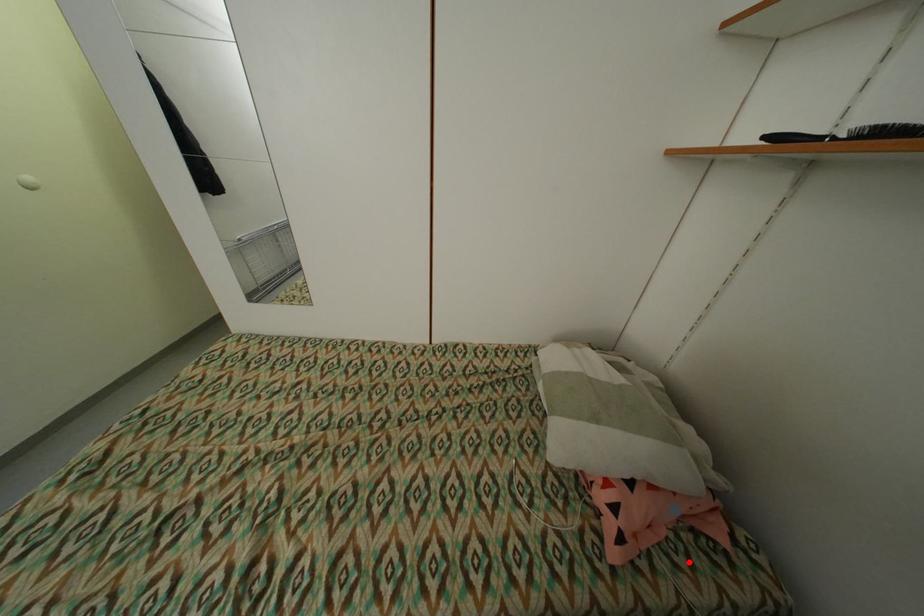
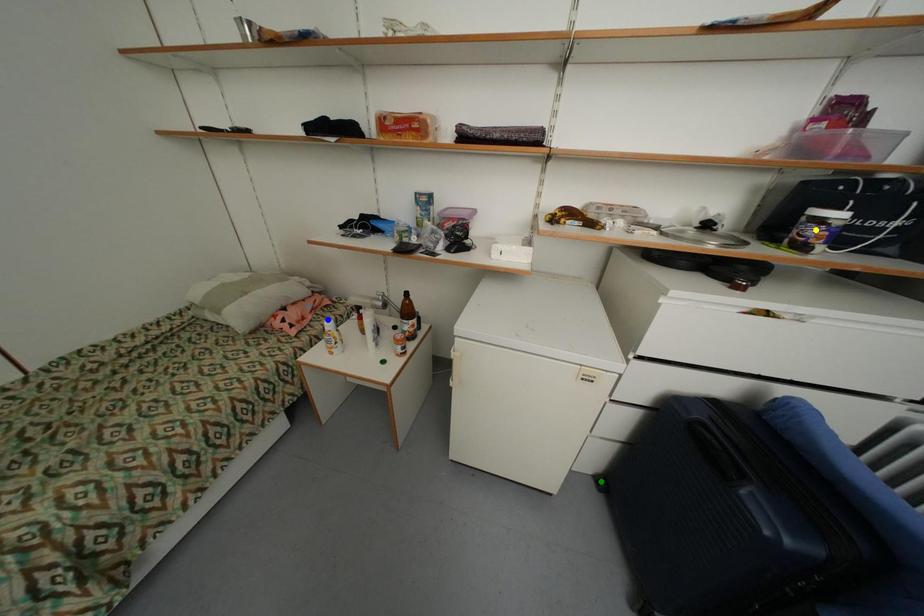
Question: I am providing you with two images of the same scene from different viewpoints. A red point is marked on the first image. You are given multiple points on the second image. Which point in image 2 represents the same 3d spot as the red point in image 1?

Choices:
 (A) yellow point
 (B) green point
 (C) blue point

Answer: (C)